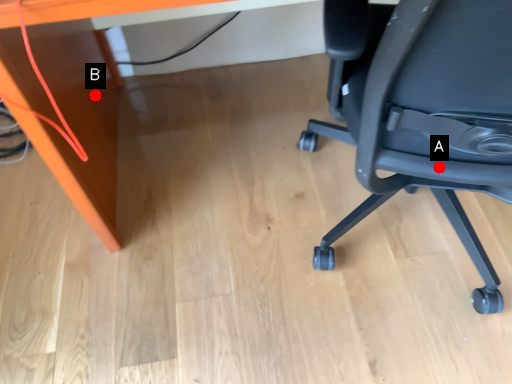
Question: Two points are circled on the image, labeled by A and B beside each circle. Which point is closer to the camera?

Choices:
 (A) A is closer
 (B) B is closer

Answer: (A)